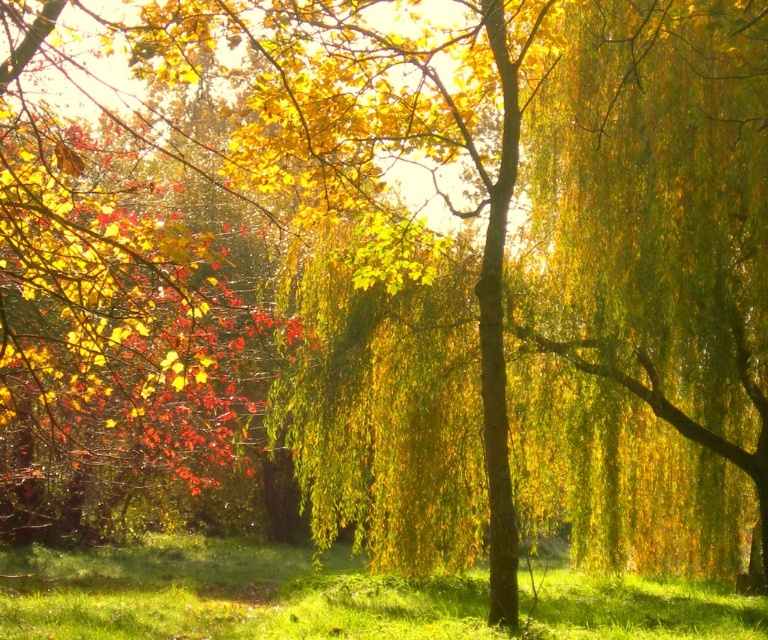
Does point (545, 214) come closer to viewer compared to point (396, 586)?

No, (545, 214) is further to viewer.

This screenshot has width=768, height=640. What do you see at coordinates (666, 214) in the screenshot? I see `golden silky willow at right` at bounding box center [666, 214].

You are a GUI agent. You are given a task and a screenshot of the screen. Output one action in this format:
    pyautogui.click(x=<x>, y=<y>)
    Task: Click on the golden silky willow at right
    The width and height of the screenshot is (768, 640).
    Given the screenshot: What is the action you would take?
    pyautogui.click(x=666, y=214)